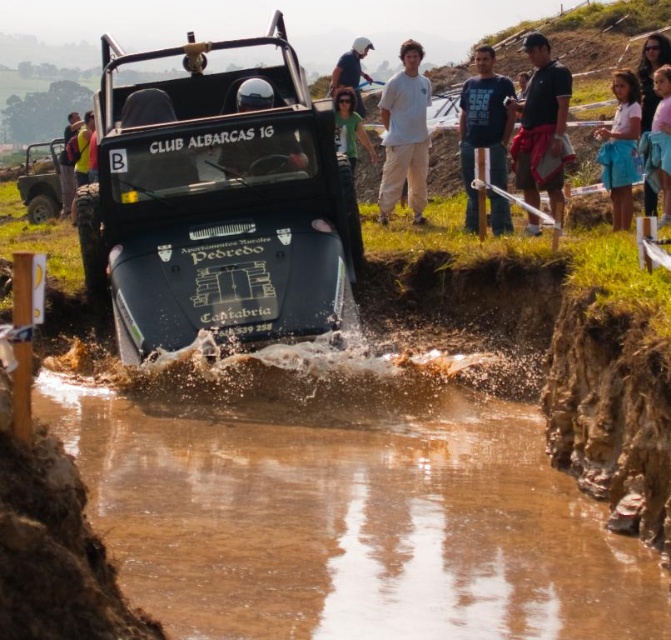
What do you see at coordinates (482, 125) in the screenshot? I see `dark blue t-shirt at center` at bounding box center [482, 125].

Is point (476, 138) positioned after point (256, 83)?

That is True.

Locate an element on the screen. dark blue t-shirt at center is located at coordinates (482, 125).

Where is `dark blue t-shirt at center`? dark blue t-shirt at center is located at coordinates (482, 125).

Is white cotton shirt at upper right wider than yellow fabric shirt at left?

No, white cotton shirt at upper right is not wider than yellow fabric shirt at left.

Is the position of white cotton shirt at upper right less distant than that of yellow fabric shirt at left?

That is True.

Locate an element on the screen. This screenshot has width=671, height=640. white cotton shirt at upper right is located at coordinates (x=619, y=147).

How much distance is there between brown muddy water at center and white helmet at upper center?

50.98 meters

Who is positioned more to the right, brown muddy water at center or white helmet at upper center?

Positioned to the right is white helmet at upper center.

The width and height of the screenshot is (671, 640). I want to click on brown muddy water at center, so click(x=344, y=506).